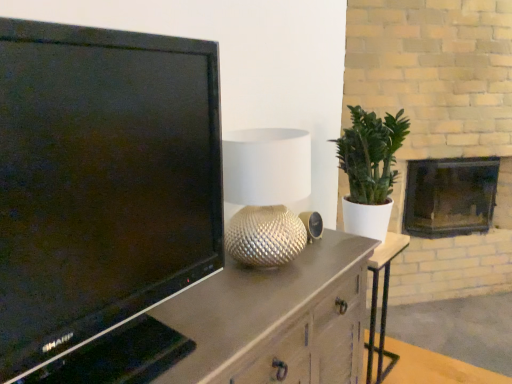
Question: Is matte brown cabinet at left thinner than dark gray stone fireplace at right?

Choices:
 (A) no
 (B) yes

Answer: (A)

Question: Does matte brown cabinet at left have a greater height compared to dark gray stone fireplace at right?

Choices:
 (A) yes
 (B) no

Answer: (A)

Question: Is matte brown cabinet at left turned away from dark gray stone fireplace at right?

Choices:
 (A) no
 (B) yes

Answer: (A)

Question: From the image's perspective, is matte brown cabinet at left located above dark gray stone fireplace at right?

Choices:
 (A) yes
 (B) no

Answer: (B)

Question: Does matte brown cabinet at left appear on the left side of dark gray stone fireplace at right?

Choices:
 (A) no
 (B) yes

Answer: (B)

Question: Is black glossy television at left inside or outside of dark gray stone fireplace at right?

Choices:
 (A) outside
 (B) inside

Answer: (A)

Question: In the image, is black glossy television at left on the left side or the right side of dark gray stone fireplace at right?

Choices:
 (A) right
 (B) left

Answer: (B)

Question: From a real-world perspective, is black glossy television at left positioned above or below dark gray stone fireplace at right?

Choices:
 (A) below
 (B) above

Answer: (B)

Question: Considering their positions, is black glossy television at left located in front of or behind dark gray stone fireplace at right?

Choices:
 (A) behind
 (B) front

Answer: (B)

Question: Is dark gray stone fireplace at right in front of or behind metallic silver side table at center in the image?

Choices:
 (A) behind
 (B) front

Answer: (A)

Question: From the image's perspective, is dark gray stone fireplace at right positioned above or below metallic silver side table at center?

Choices:
 (A) above
 (B) below

Answer: (A)

Question: Considering the positions of point (424, 215) and point (389, 236), is point (424, 215) closer or farther from the camera than point (389, 236)?

Choices:
 (A) closer
 (B) farther

Answer: (B)

Question: Considering the positions of dark gray stone fireplace at right and metallic silver side table at center in the image, is dark gray stone fireplace at right wider or thinner than metallic silver side table at center?

Choices:
 (A) wide
 (B) thin

Answer: (A)

Question: Is dark gray stone fireplace at right bigger or smaller than silver textured lamp at center?

Choices:
 (A) small
 (B) big

Answer: (B)

Question: From a real-world perspective, is dark gray stone fireplace at right above or below silver textured lamp at center?

Choices:
 (A) below
 (B) above

Answer: (A)